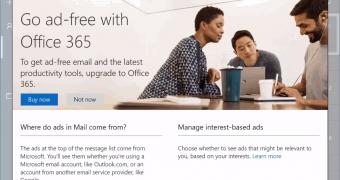
The width and height of the screenshot is (340, 180). In order to click on table in this screenshot , I will do `click(234, 105)`.